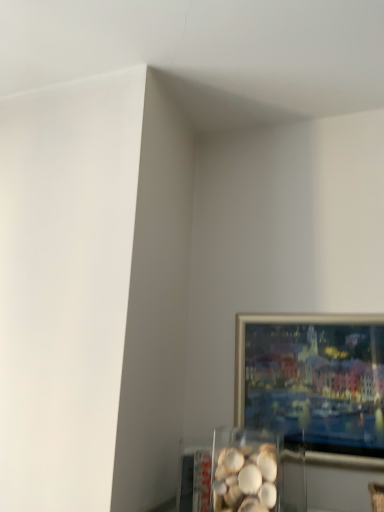
Question: Should I look upward or downward to see white matte seashells at lower center?

Choices:
 (A) down
 (B) up

Answer: (A)